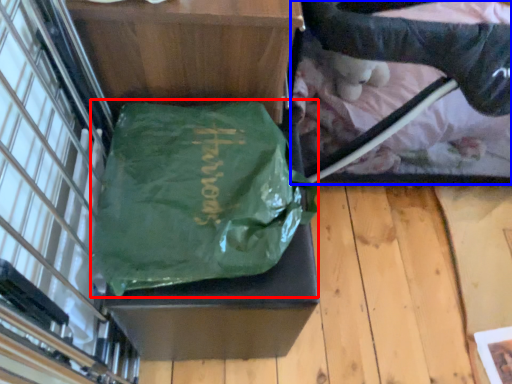
Question: Which object is further to the camera taking this photo, tote bag (highlighted by a red box) or baby carriage (highlighted by a blue box)?

Choices:
 (A) tote bag
 (B) baby carriage

Answer: (B)